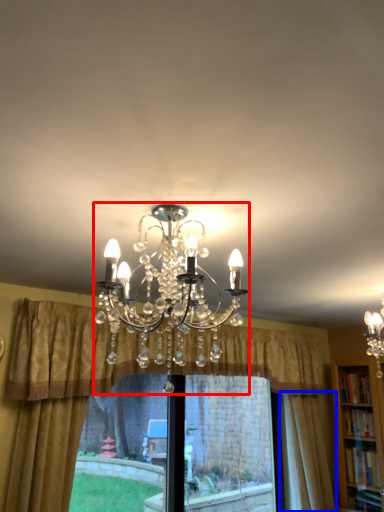
Question: Which point is further to the camera, lamp (highlighted by a red box) or curtain (highlighted by a blue box)?

Choices:
 (A) lamp
 (B) curtain

Answer: (B)